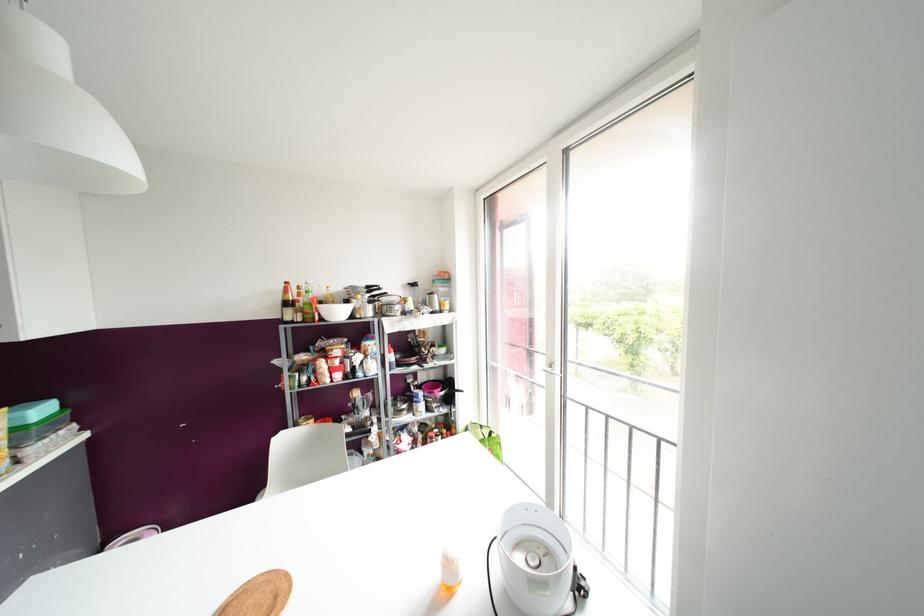
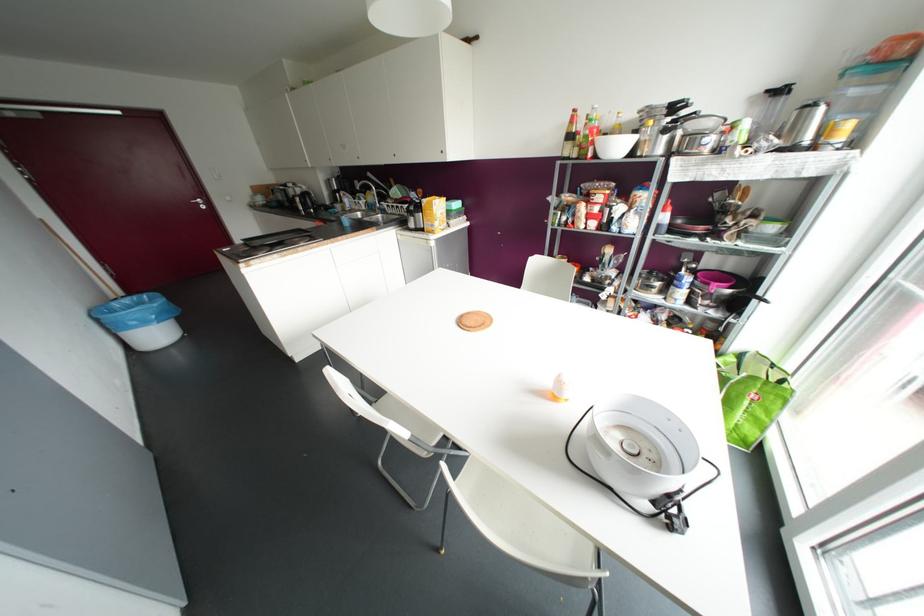
In the second image, find the point that corresponds to (x=543, y=561) in the first image.

(642, 459)